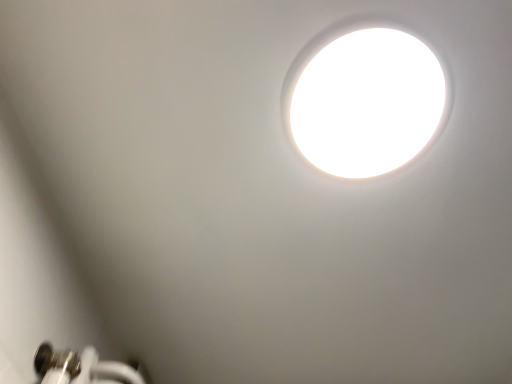
Image resolution: width=512 pixels, height=384 pixels. What do you see at coordinates (367, 103) in the screenshot?
I see `white glossy light bulb at upper center` at bounding box center [367, 103].

Where is `white glossy light bulb at upper center`? This screenshot has height=384, width=512. white glossy light bulb at upper center is located at coordinates (367, 103).

This screenshot has width=512, height=384. What are the coordinates of `white glossy light bulb at upper center` in the screenshot? It's located at (367, 103).